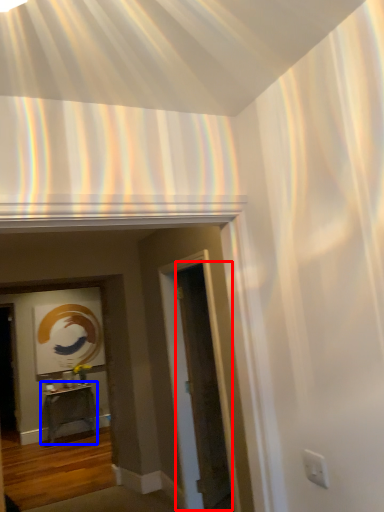
Question: Which object is further to the camera taking this photo, glass door (highlighted by a red box) or table (highlighted by a blue box)?

Choices:
 (A) glass door
 (B) table

Answer: (B)